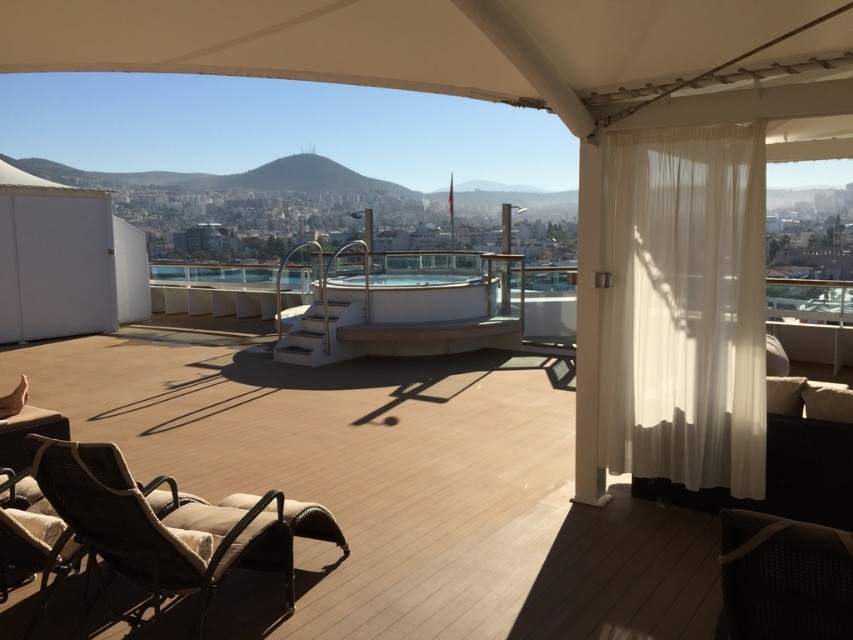
You are planning to hang a large painting on the wall behind the white sheer curtain at right and the brown woven armchair at lower left. Which object would allow more space for the painting due to its size?

The brown woven armchair at lower left is larger than the white sheer curtain at right, so hanging the painting behind the brown woven armchair at lower left would provide more space.

You are a delivery person carrying a package that requires a clear path of at least 7 feet to maneuver. You need to move from the white sheer curtain at right to the dark brown woven armchair at lower right on the terrace. Can you navigate this path without obstacles?

The distance between the white sheer curtain at right and the dark brown woven armchair at lower right is 6.96 feet, which is slightly less than the required 7 feet. Therefore, you may not have enough space to maneuver the package safely.

You are standing on the raised platform with a glass railing and want to move to the dark brown woven armchair at lower right. Is the white sheer curtain at right blocking your path?

The dark brown woven armchair at lower right is behind the white sheer curtain at right, so the curtain is blocking your path.